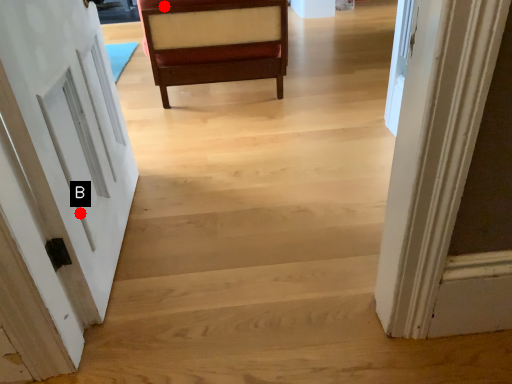
Question: Two points are circled on the image, labeled by A and B beside each circle. Which of the following is the farthest from the observer?

Choices:
 (A) A is further
 (B) B is further

Answer: (A)